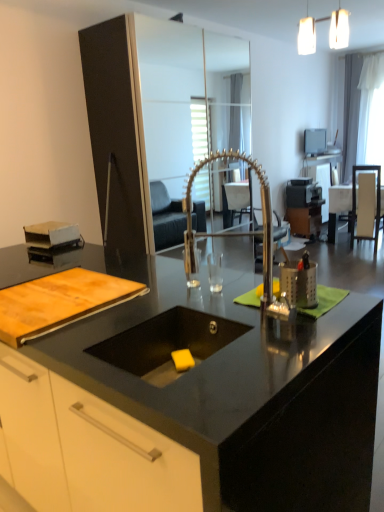
Question: From a real-world perspective, is black granite countertop at center above or below black glossy sink at center?

Choices:
 (A) above
 (B) below

Answer: (B)

Question: From the image's perspective, is black granite countertop at center positioned above or below black glossy sink at center?

Choices:
 (A) above
 (B) below

Answer: (B)

Question: Estimate the real-world distances between objects in this image. Which object is farther from the matte black television at upper center?

Choices:
 (A) white matte light fixture at upper right
 (B) wooden table at right
 (C) black granite countertop at center
 (D) polished metallic faucet at center
 (E) black glossy sink at center

Answer: (C)

Question: Based on their relative distances, which object is nearer to the white matte light fixture at upper right?

Choices:
 (A) black granite countertop at center
 (B) matte black television at upper center
 (C) wooden table at right
 (D) white sheer curtain at upper right
 (E) wooden cutting board at lower left

Answer: (E)